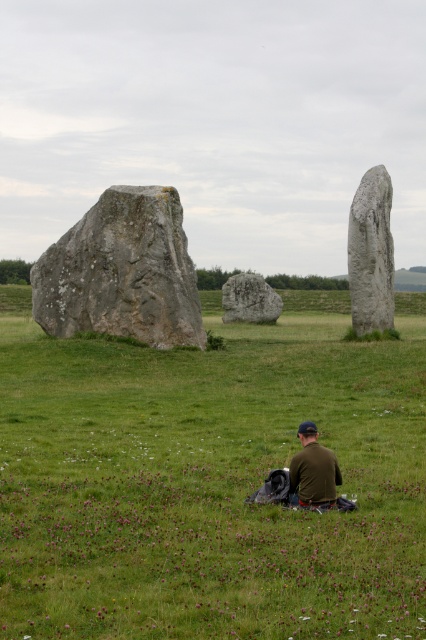
Question: Which of the following is the closest to the observer?

Choices:
 (A) (176, 220)
 (B) (377, 326)
 (C) (227, 298)
 (D) (394, 540)

Answer: (D)

Question: Which object is closer to the camera taking this photo?

Choices:
 (A) rough stone monolith at left
 (B) gray stone at center
 (C) smooth gray stone at right

Answer: (B)

Question: Does gray stone at center appear on the right side of gray stone boulder at center?

Choices:
 (A) no
 (B) yes

Answer: (A)

Question: Does smooth gray stone at right appear over gray stone boulder at center?

Choices:
 (A) yes
 (B) no

Answer: (A)

Question: Which point is farther from the camera taking this photo?

Choices:
 (A) (226, 296)
 (B) (203, 460)
 (C) (92, 276)

Answer: (A)

Question: Is gray stone at center to the right of gray stone boulder at center from the viewer's perspective?

Choices:
 (A) yes
 (B) no

Answer: (B)